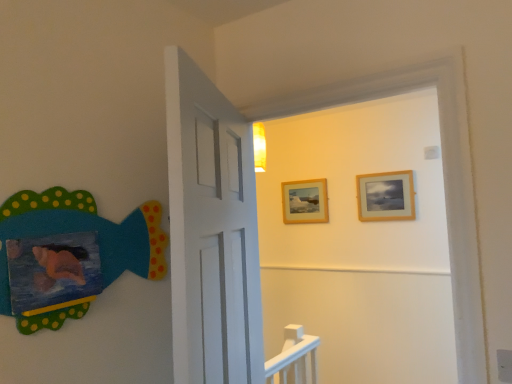
Question: Considering the relative positions of matte felt fish at left and wooden frame at upper center, marked as the first picture frame in a back-to-front arrangement, in the image provided, is matte felt fish at left to the left of wooden frame at upper center, marked as the first picture frame in a back-to-front arrangement, from the viewer's perspective?

Choices:
 (A) no
 (B) yes

Answer: (B)

Question: Are matte felt fish at left and wooden frame at upper center, the second picture frame viewed from the right, beside each other?

Choices:
 (A) no
 (B) yes

Answer: (A)

Question: Is matte felt fish at left not close to wooden frame at upper center, the second picture frame viewed from the right?

Choices:
 (A) yes
 (B) no

Answer: (A)

Question: From a real-world perspective, does matte felt fish at left sit lower than wooden frame at upper center, the 1th picture frame in the left-to-right sequence?

Choices:
 (A) no
 (B) yes

Answer: (B)

Question: Is wooden frame at upper center, the 2th picture frame viewed from the front, surrounded by matte felt fish at left?

Choices:
 (A) yes
 (B) no

Answer: (B)

Question: Considering the positions of wooden frame at upper center, the 2th picture frame viewed from the front, and wooden frame at upper right, positioned as the 1th picture frame in right-to-left order, in the image, is wooden frame at upper center, the 2th picture frame viewed from the front, wider or thinner than wooden frame at upper right, positioned as the 1th picture frame in right-to-left order,?

Choices:
 (A) thin
 (B) wide

Answer: (A)

Question: Do you think wooden frame at upper center, the second picture frame viewed from the right, is within wooden frame at upper right, which ranks as the 2th picture frame in left-to-right order, or outside of it?

Choices:
 (A) inside
 (B) outside

Answer: (B)

Question: Relative to wooden frame at upper right, the 2th picture frame when ordered from back to front, is wooden frame at upper center, the 2th picture frame viewed from the front, in front or behind?

Choices:
 (A) behind
 (B) front

Answer: (A)

Question: From the image's perspective, relative to wooden frame at upper right, placed as the first picture frame when sorted from front to back, is wooden frame at upper center, marked as the first picture frame in a back-to-front arrangement, above or below?

Choices:
 (A) above
 (B) below

Answer: (B)

Question: In terms of width, does wooden frame at upper right, placed as the first picture frame when sorted from front to back, look wider or thinner when compared to wooden frame at upper center, marked as the first picture frame in a back-to-front arrangement?

Choices:
 (A) thin
 (B) wide

Answer: (B)

Question: Considering the positions of wooden frame at upper right, placed as the first picture frame when sorted from front to back, and wooden frame at upper center, the 2th picture frame viewed from the front, in the image, is wooden frame at upper right, placed as the first picture frame when sorted from front to back, bigger or smaller than wooden frame at upper center, the 2th picture frame viewed from the front,?

Choices:
 (A) small
 (B) big

Answer: (B)

Question: From a real-world perspective, is wooden frame at upper right, which ranks as the 2th picture frame in left-to-right order, positioned above or below wooden frame at upper center, the second picture frame viewed from the right?

Choices:
 (A) below
 (B) above

Answer: (B)

Question: Considering the positions of point (398, 195) and point (303, 218), is point (398, 195) closer or farther from the camera than point (303, 218)?

Choices:
 (A) farther
 (B) closer

Answer: (B)

Question: Is matte felt fish at left bigger or smaller than wooden frame at upper center, marked as the first picture frame in a back-to-front arrangement?

Choices:
 (A) small
 (B) big

Answer: (B)

Question: Which is correct: matte felt fish at left is inside wooden frame at upper center, the 2th picture frame viewed from the front, or outside of it?

Choices:
 (A) inside
 (B) outside

Answer: (B)